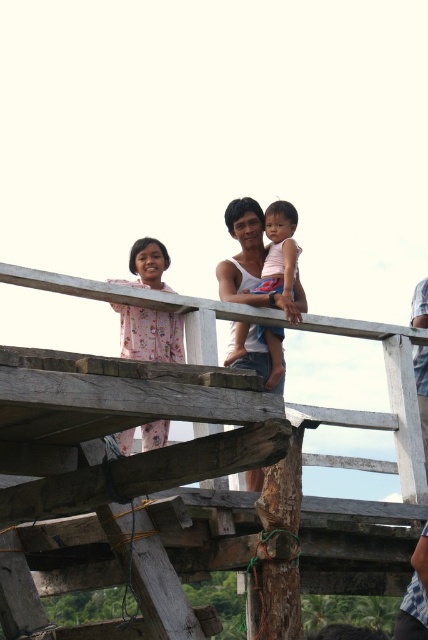
Question: Which point is farther to the camera?

Choices:
 (A) (178, 346)
 (B) (249, 364)
 (C) (321, 512)

Answer: (B)

Question: In this image, where is pink fabric at center located relative to pink floral dress at upper left?

Choices:
 (A) above
 (B) below

Answer: (A)

Question: Considering the real-world distances, which object is closest to the pink floral dress at upper left?

Choices:
 (A) wooden at upper center
 (B) pink fabric at center

Answer: (B)

Question: Can you confirm if pink fabric at center is bigger than pink floral dress at upper left?

Choices:
 (A) no
 (B) yes

Answer: (A)

Question: Can you confirm if wooden at upper center is positioned to the right of pink fabric at center?

Choices:
 (A) yes
 (B) no

Answer: (B)

Question: Which of the following is the farthest from the observer?

Choices:
 (A) pink floral dress at upper left
 (B) wooden at upper center
 (C) pink fabric at center

Answer: (C)